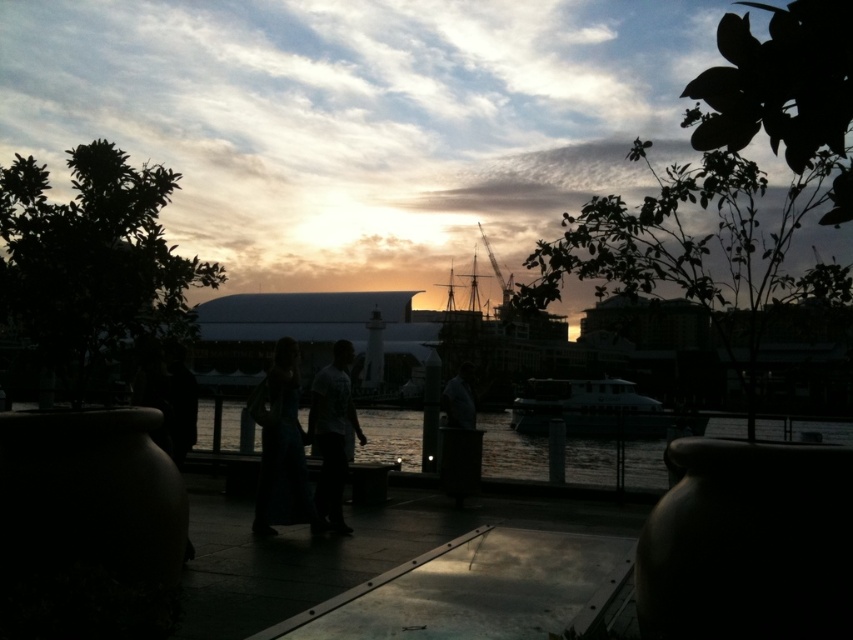
Is the position of white glossy boat at center less distant than that of light brown fabric shirt at center?

No, white glossy boat at center is behind light brown fabric shirt at center.

The image size is (853, 640). What do you see at coordinates (596, 410) in the screenshot?
I see `white glossy boat at center` at bounding box center [596, 410].

Does point (523, 397) come behind point (334, 516)?

Yes.

Find the location of a particular element. Image resolution: width=853 pixels, height=640 pixels. white glossy boat at center is located at coordinates (596, 410).

Between transparent glass water at center and white glossy boat at center, which one is positioned higher?

Positioned higher is white glossy boat at center.

Is transparent glass water at center closer to the viewer compared to white glossy boat at center?

No, it is behind white glossy boat at center.

Between point (804, 428) and point (554, 400), which one is positioned behind?

Positioned behind is point (554, 400).

Where is `transparent glass water at center`? The height and width of the screenshot is (640, 853). transparent glass water at center is located at coordinates (509, 451).

Consider the image. Which is below, transparent glass water at center or dark gray fabric jacket at center?

Positioned lower is transparent glass water at center.

Is the position of transparent glass water at center more distant than that of dark gray fabric jacket at center?

Yes.

This screenshot has width=853, height=640. In order to click on transparent glass water at center in this screenshot , I will do `click(509, 451)`.

Where is `transparent glass water at center`? The image size is (853, 640). transparent glass water at center is located at coordinates (509, 451).